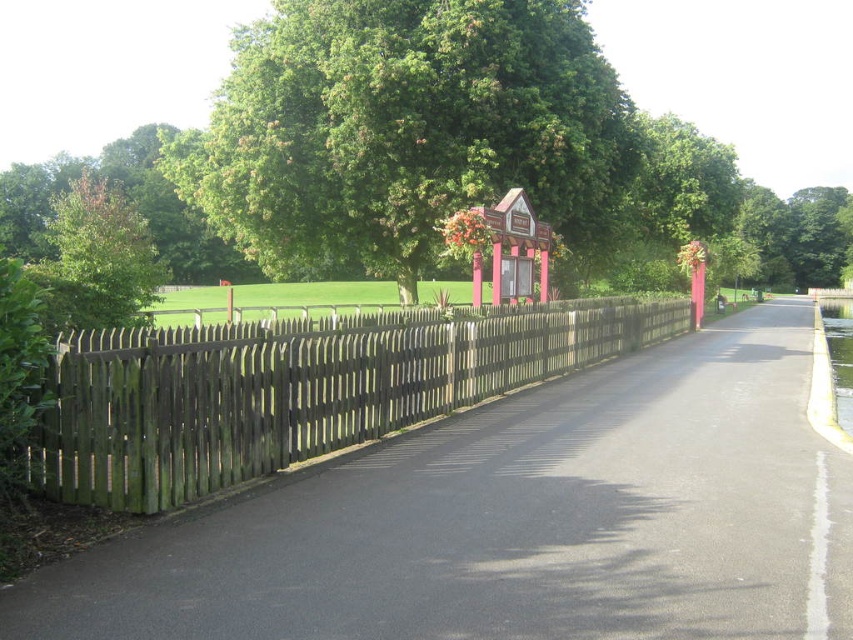
Question: Can you confirm if green leafy tree at center is bigger than green leafy tree at left?

Choices:
 (A) yes
 (B) no

Answer: (B)

Question: Does weathered wood fence at left come in front of green leafy tree at left?

Choices:
 (A) no
 (B) yes

Answer: (B)

Question: Which is farther from the green leafy tree at center?

Choices:
 (A) green leafy tree at left
 (B) weathered wood fence at left

Answer: (B)

Question: Which point is farther from the camera taking this photo?

Choices:
 (A) (381, 216)
 (B) (138, 227)

Answer: (A)

Question: Can you confirm if weathered wood fence at left is positioned to the left of green leafy tree at left?

Choices:
 (A) yes
 (B) no

Answer: (B)

Question: Based on their relative distances, which object is nearer to the green leafy tree at left?

Choices:
 (A) weathered wood fence at left
 (B) green leafy tree at center

Answer: (B)